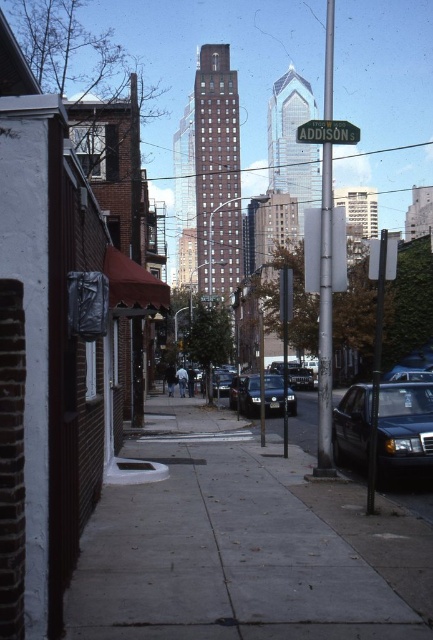
Which is below, shiny black sedan at center or green metallic street sign at center?

shiny black sedan at center

Is point (278, 390) farther from viewer compared to point (319, 141)?

Yes, point (278, 390) is behind point (319, 141).

Does point (281, 385) lie in front of point (333, 136)?

No, it is behind (333, 136).

Locate an element on the screen. shiny black sedan at center is located at coordinates (249, 396).

Is silver metallic pole at center further to camera compared to green metallic street sign at center?

That is False.

Image resolution: width=433 pixels, height=640 pixels. In order to click on silver metallic pole at center in this screenshot , I will do `click(325, 324)`.

Between point (326, 145) and point (349, 131), which one is positioned behind?

Point (349, 131)

In order to click on silver metallic pole at center in this screenshot , I will do `click(325, 324)`.

Is the position of shiny black sedan at lower right less distant than that of silver metallic pole at center?

Yes.

Is shiny black sedan at lower right taller than silver metallic pole at center?

No, shiny black sedan at lower right is not taller than silver metallic pole at center.

I want to click on shiny black sedan at lower right, so click(403, 428).